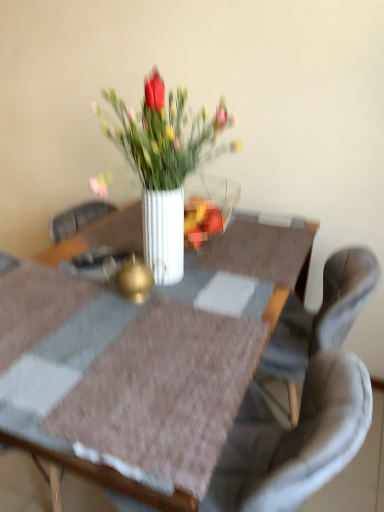
Where is `free space above white glossy vase at center (from a real-world perspective)`? free space above white glossy vase at center (from a real-world perspective) is located at coordinates (130, 301).